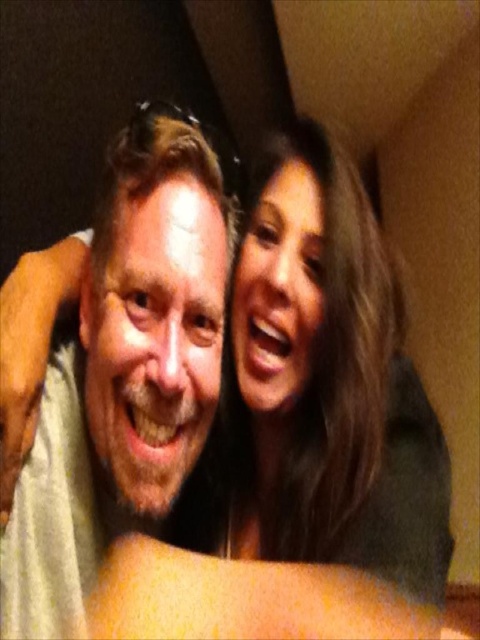
Based on the scene description, which object is larger in size between the smooth brown hair at upper right and the white matte shirt at center?

The smooth brown hair at upper right is bigger than the white matte shirt at center according to the description.